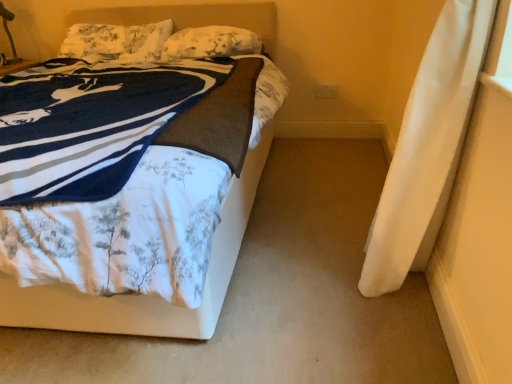
Where is `vacant space underneath metallic gold table lamp at upper left (from a real-world perspective)`? The image size is (512, 384). vacant space underneath metallic gold table lamp at upper left (from a real-world perspective) is located at coordinates (8, 62).